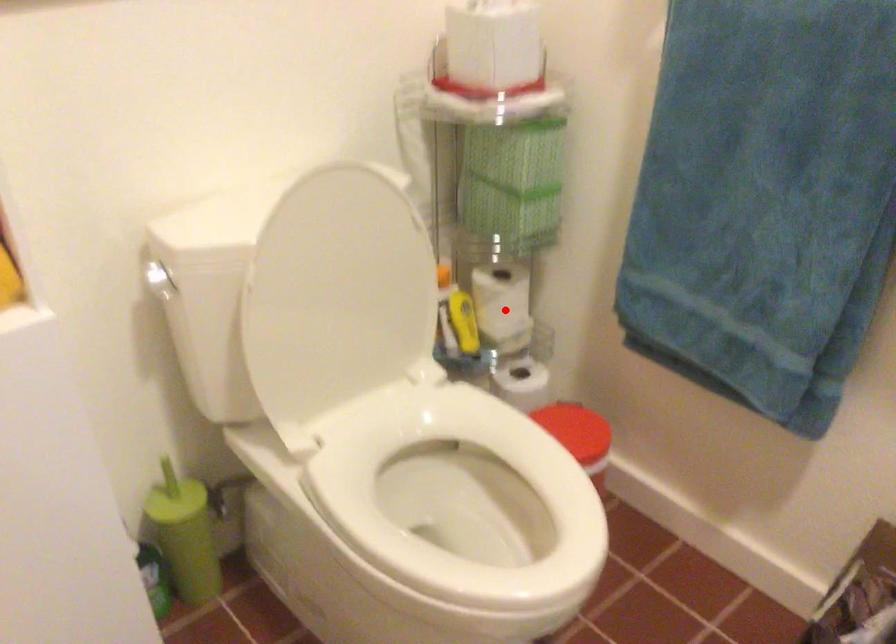
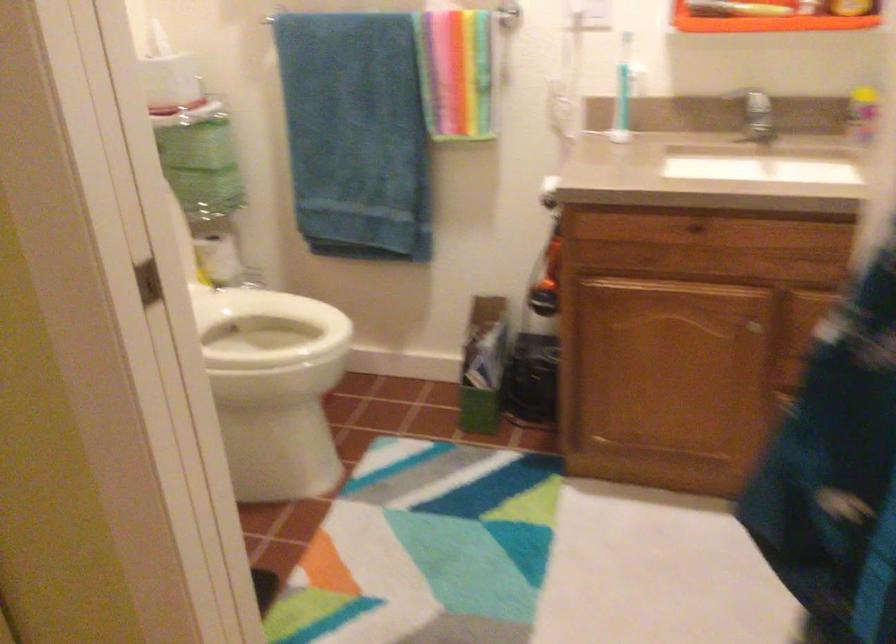
Where in the second image is the point corresponding to the highlighted location from the first image?

(219, 259)